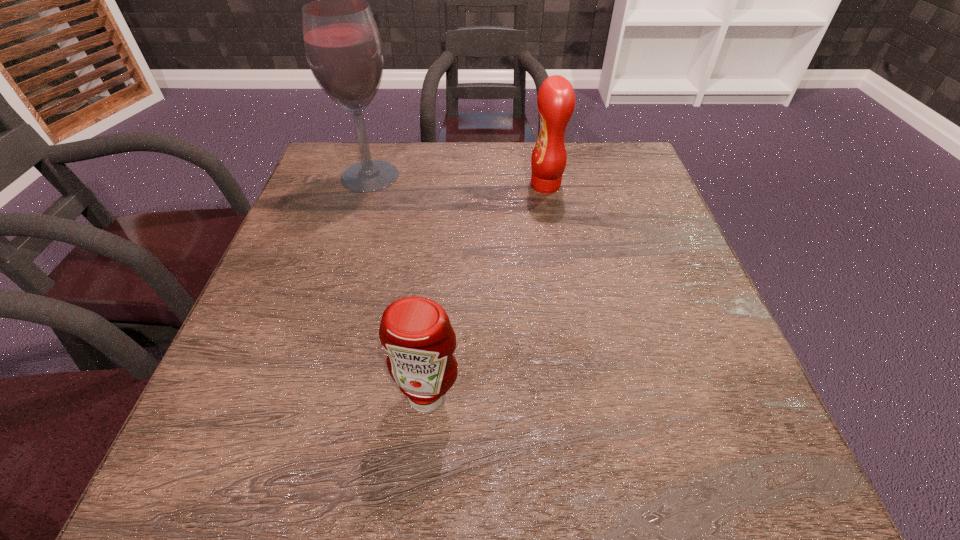
The width and height of the screenshot is (960, 540). I want to click on vacant region at the far right corner of the desktop, so click(637, 151).

The image size is (960, 540). What are the coordinates of `free location at the near right corner of the desktop` in the screenshot? It's located at (688, 477).

You are a GUI agent. You are given a task and a screenshot of the screen. Output one action in this format:
    pyautogui.click(x=<x>, y=<y>)
    Task: Click on the unoccupied position between the leftmost object and the right condiment
    
    Given the screenshot: What is the action you would take?
    pyautogui.click(x=458, y=180)

The image size is (960, 540). Identify the location of free space between the shortest object and the taller condiment. (487, 291).

At what (x,y) coordinates should I click in order to perform the action: click on vacant space that is in between the left condiment and the tallest object. Please return your answer as a coordinate pair (x, y). Looking at the image, I should click on (398, 286).

At what (x,y) coordinates should I click in order to perform the action: click on free area in between the right condiment and the leftmost object. Please return your answer as a coordinate pair (x, y). The width and height of the screenshot is (960, 540). Looking at the image, I should click on (458, 180).

This screenshot has height=540, width=960. In order to click on free space between the second shortest object and the tallest object in this screenshot , I will do `click(458, 180)`.

You are a GUI agent. You are given a task and a screenshot of the screen. Output one action in this format:
    pyautogui.click(x=<x>, y=<y>)
    Task: Click on the free space between the right condiment and the shorter condiment
    
    Given the screenshot: What is the action you would take?
    pyautogui.click(x=487, y=291)

The width and height of the screenshot is (960, 540). I want to click on vacant space that's between the leftmost object and the farther condiment, so click(458, 180).

Identify the location of vacant space that's between the nearer condiment and the leftmost object. (398, 286).